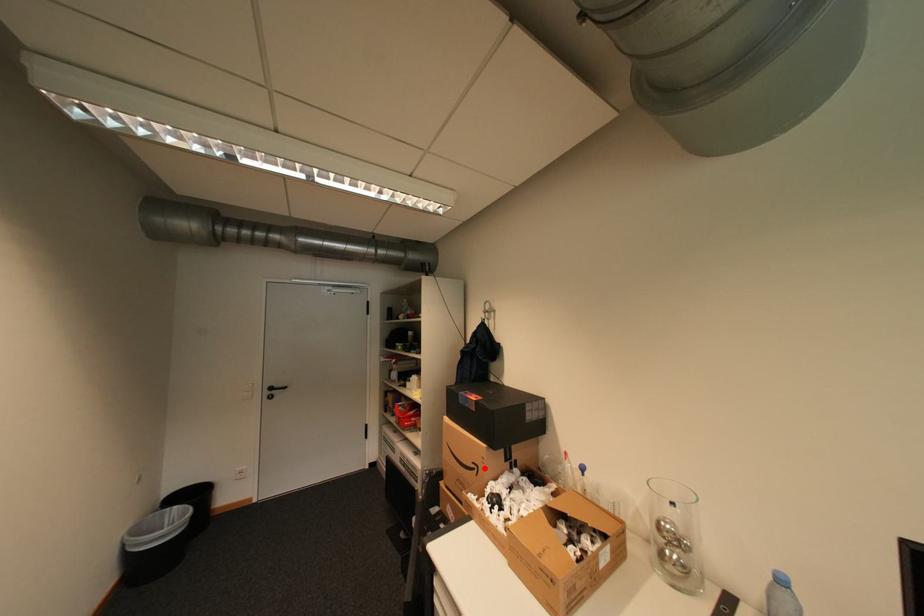
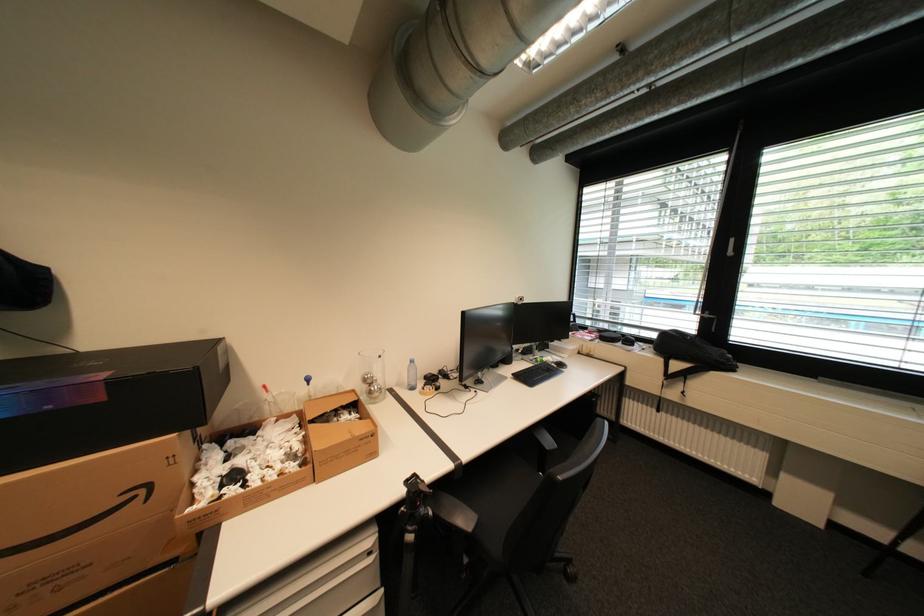
Find the pixel in the second image that matches the highlighted location in the first image.

(151, 491)